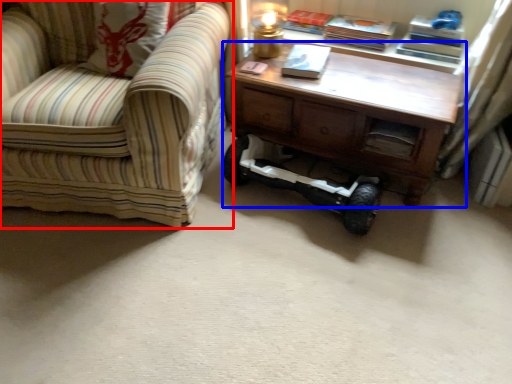
Question: Which object appears farthest to the camera in this image, chair (highlighted by a red box) or table (highlighted by a blue box)?

Choices:
 (A) chair
 (B) table

Answer: (B)